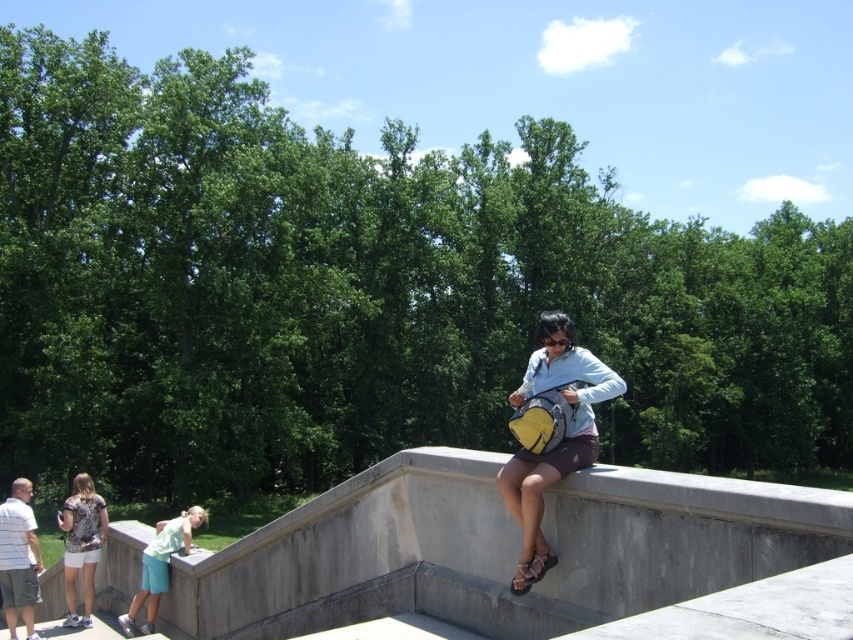
From the picture: Is matte yellow backpack at center further to the viewer compared to light blue denim shorts at lower left?

No, it is in front of light blue denim shorts at lower left.

Who is more forward, (x=561, y=380) or (x=143, y=627)?

Positioned in front is point (x=561, y=380).

Is point (560, 445) in front of point (200, 522)?

Yes, point (560, 445) is in front of point (200, 522).

The height and width of the screenshot is (640, 853). I want to click on matte yellow backpack at center, so click(560, 438).

Consider the image. Between matte yellow backpack at center and printed fabric shirt at lower left, which one is positioned higher?

matte yellow backpack at center is higher up.

Is point (589, 378) positioned after point (90, 541)?

That is False.

What do you see at coordinates (560, 438) in the screenshot? I see `matte yellow backpack at center` at bounding box center [560, 438].

Locate an element on the screen. The width and height of the screenshot is (853, 640). matte yellow backpack at center is located at coordinates (560, 438).

Which is behind, point (65, 557) or point (141, 579)?

The point (65, 557) is behind.

Which is in front, point (84, 545) or point (155, 593)?

Positioned in front is point (155, 593).

What are the coordinates of `printed fabric shirt at lower left` in the screenshot? It's located at (80, 545).